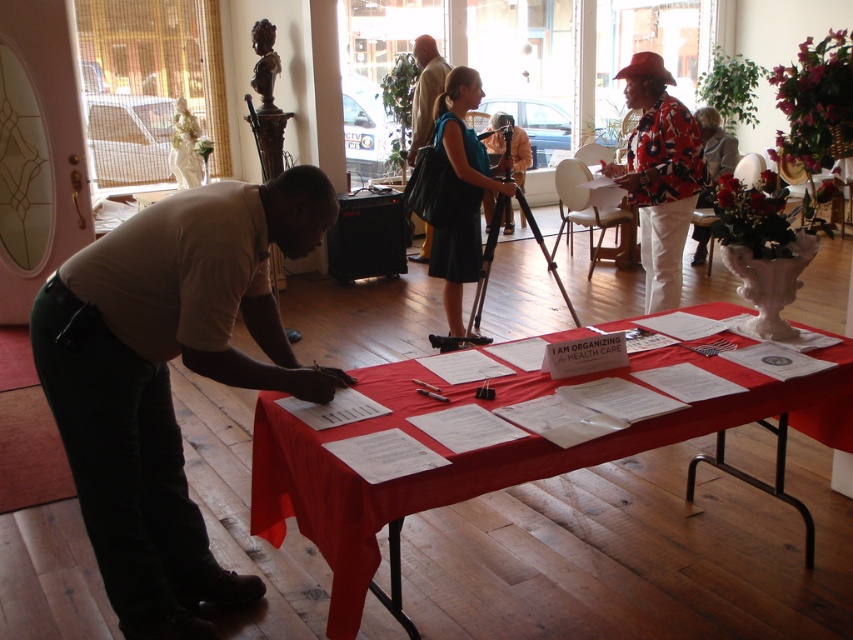
Where is `light brown shirt at left`? light brown shirt at left is located at coordinates (167, 378).

This screenshot has width=853, height=640. I want to click on light brown shirt at left, so click(167, 378).

You are a GUI agent. You are given a task and a screenshot of the screen. Output one action in this format:
    pyautogui.click(x=<x>, y=<y>)
    Task: Click on the light brown shirt at left
    The image size is (853, 640).
    Given the screenshot: What is the action you would take?
    pos(167,378)

Does point (323, 477) come behind point (664, 92)?

No.

Between red cloth-covered table at center and floral-patterned fabric at center, which one is positioned higher?

floral-patterned fabric at center is higher up.

The image size is (853, 640). Describe the element at coordinates (488, 456) in the screenshot. I see `red cloth-covered table at center` at that location.

Find the location of a particular element. red cloth-covered table at center is located at coordinates [488, 456].

Who is more distant from viewer, (657,170) or (431,227)?

Point (431,227)

Can you confirm if floral-patterned fabric at center is positioned below light beige suit at center?

Indeed, floral-patterned fabric at center is positioned under light beige suit at center.

Where is `floral-patterned fabric at center`? Image resolution: width=853 pixels, height=640 pixels. floral-patterned fabric at center is located at coordinates (659, 173).